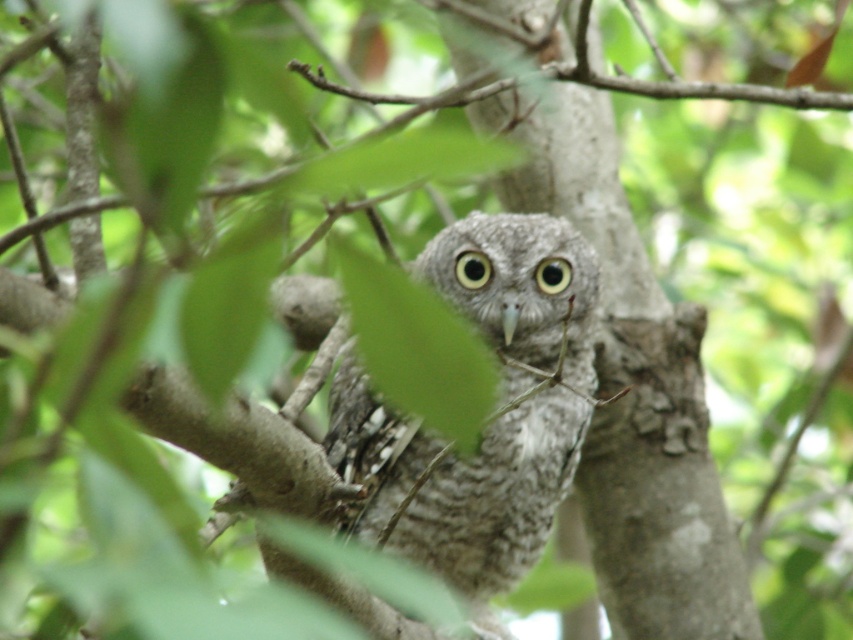
Can you confirm if speckled gray owl at center is positioned to the left of yellow matte eye at center?

Correct, you'll find speckled gray owl at center to the left of yellow matte eye at center.

Between point (576, 273) and point (566, 284), which one is positioned in front?

Point (566, 284) is more forward.

Is point (579, 241) positioned in front of point (541, 285)?

No, (579, 241) is further to viewer.

Locate an element on the screen. The image size is (853, 640). speckled gray owl at center is located at coordinates (496, 497).

Between speckled gray owl at center and black matte eye at center, which one appears on the right side from the viewer's perspective?

Positioned to the right is speckled gray owl at center.

Is speckled gray owl at center thinner than black matte eye at center?

No, speckled gray owl at center is not thinner than black matte eye at center.

Is point (556, 458) positioned in front of point (463, 272)?

No, it is behind (463, 272).

Locate an element on the screen. The image size is (853, 640). speckled gray owl at center is located at coordinates (496, 497).

Between black matte eye at center and yellow matte eye at center, which one has less height?

With less height is yellow matte eye at center.

Between point (469, 264) and point (550, 284), which one is positioned in front?

Point (469, 264)

This screenshot has height=640, width=853. I want to click on black matte eye at center, so click(x=473, y=269).